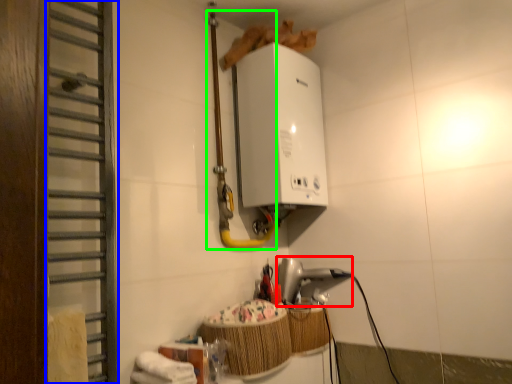
Question: Which object is the farthest from appliance (highlighted by a red box)? Choose among these: door (highlighted by a blue box) or pipe (highlighted by a green box).

Choices:
 (A) door
 (B) pipe

Answer: (A)